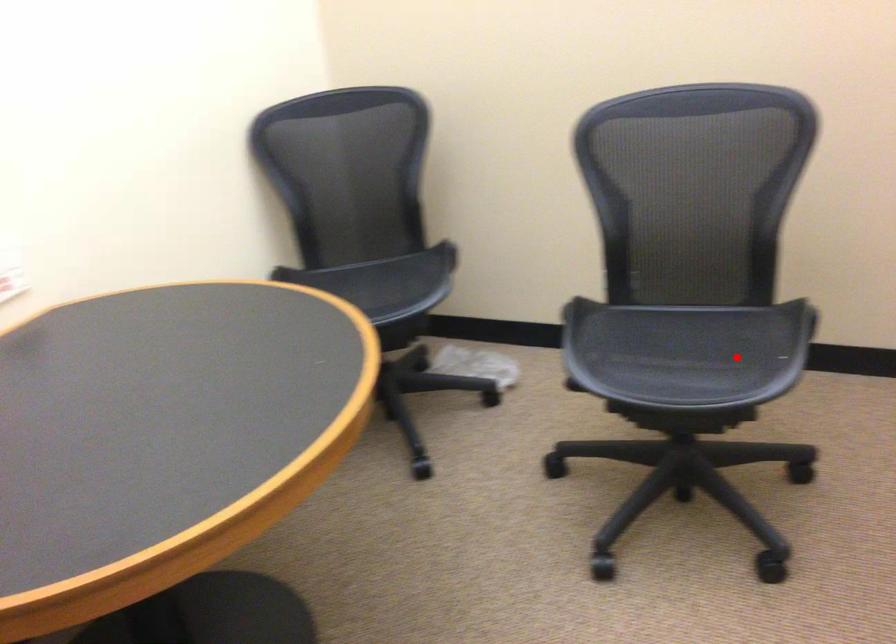
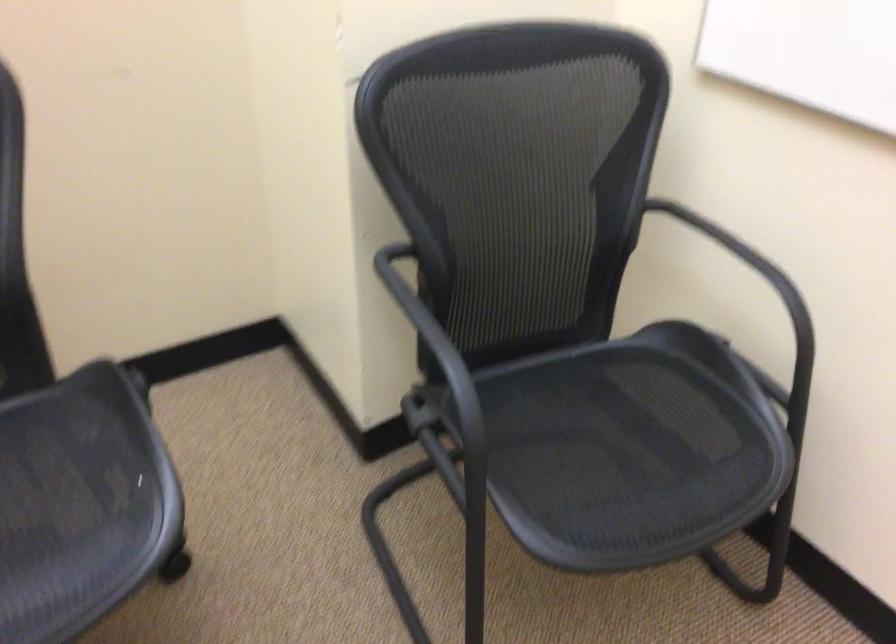
Question: I am providing you with two images of the same scene from different viewpoints. A red point is shown in image1. For the corresponding object point in image2, is it positioned nearer or farther from the camera?

Choices:
 (A) Nearer
 (B) Farther

Answer: (A)